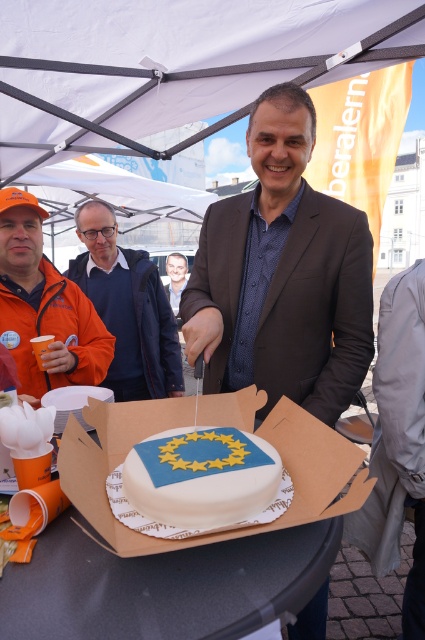
You are attending the event and want to take a photo of both the blue fondant cake at center and the blue fabric jacket at center. Which one should you focus on first to ensure both are in the frame?

The blue fondant cake at center is below the blue fabric jacket at center, so you should focus on the blue fabric jacket at center first to ensure both are in the frame.

Looking at this image, based on the scene description, where is the orange fabric jacket at upper left located in the image?

The orange fabric jacket at upper left is located at point (44, 307) in the image.

You are attending a formal event and need to choose between the matte brown suit at center and the blue fabric jacket at center. Based on their sizes, which one would be more appropriate for a formal event?

The matte brown suit at center is larger in size than the blue fabric jacket at center, making it more suitable for a formal event as suits are typically larger and more structured compared to jackets.